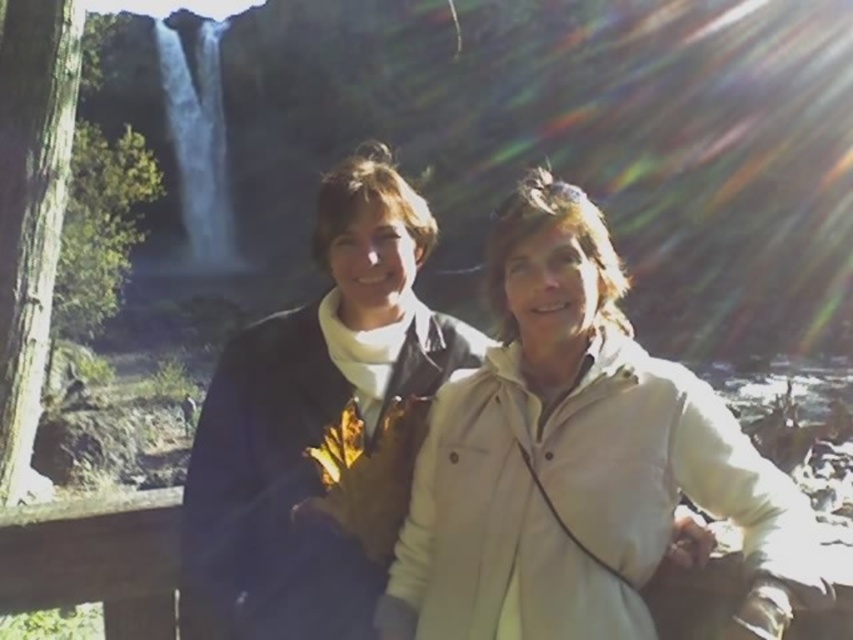
You are a photographer trying to capture the two people in the scene. The dark blue jacket at center and the white smooth water at upper left are both in your viewfinder. If you want to ensure both are fully visible in the photo, which object should you adjust your focus on to account for their size difference?

The dark blue jacket at center is thinner than the white smooth water at upper left. To ensure both are fully visible, focus on the white smooth water at upper left since it is wider, allowing the narrower dark blue jacket at center to fit within the frame.

You are standing at the waterfall and want to take a photo of the wooden rail at center. Where should you aim your camera to capture it?

The wooden rail at center is located at coordinates point [96,557], so aim your camera there to capture it.

You are a photographer planning to take a picture of the wooden rail at center and the white smooth water at upper left. Based on their positions, which object should you focus on first to ensure both are in the frame?

The wooden rail at center is positioned under the white smooth water at upper left, so you should focus on the white smooth water at upper left first to ensure both are in the frame.